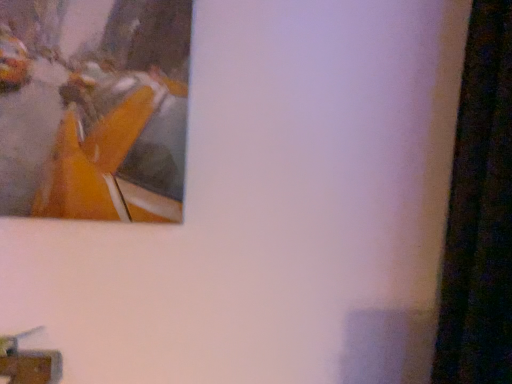
Locate an element on the screen. The image size is (512, 384). matte wooden picture frame at upper left is located at coordinates (94, 108).

This screenshot has height=384, width=512. What do you see at coordinates (94, 108) in the screenshot? I see `matte wooden picture frame at upper left` at bounding box center [94, 108].

Locate an element on the screen. The width and height of the screenshot is (512, 384). matte wooden picture frame at upper left is located at coordinates (94, 108).